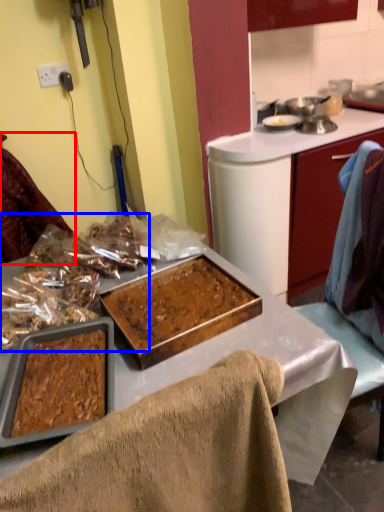
Question: Which of the following is the farthest to the observer, leftover (highlighted by a red box) or food (highlighted by a blue box)?

Choices:
 (A) leftover
 (B) food

Answer: (A)